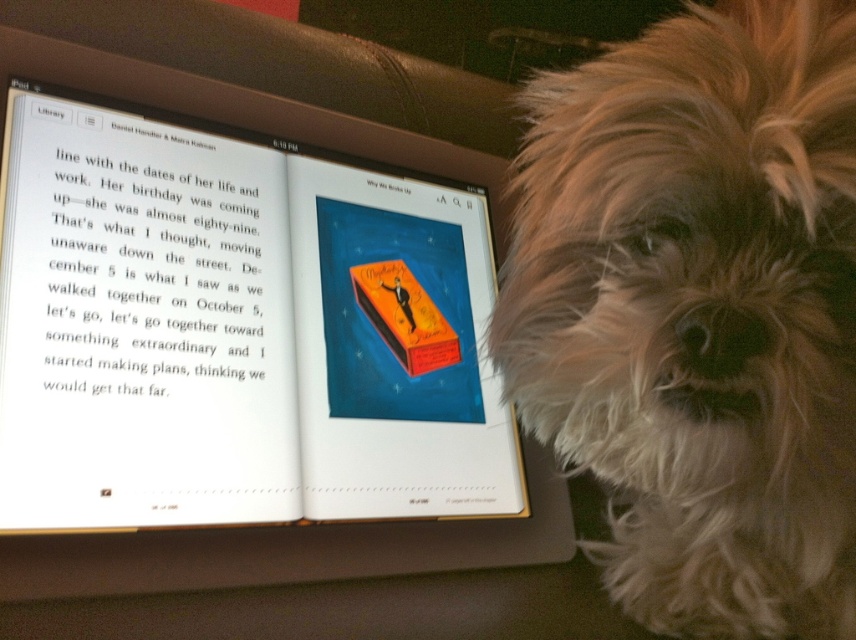
Between matte orange book at center and fluffy white fur at right, which one appears on the left side from the viewer's perspective?

matte orange book at center

Who is more distant from viewer, (276,410) or (770,412)?

Positioned behind is point (276,410).

Between point (117, 212) and point (755, 488), which one is positioned behind?

The point (117, 212) is behind.

You are a GUI agent. You are given a task and a screenshot of the screen. Output one action in this format:
    pyautogui.click(x=<x>, y=<y>)
    Task: Click on the matte orange book at center
    The image size is (856, 640).
    Given the screenshot: What is the action you would take?
    pyautogui.click(x=236, y=332)